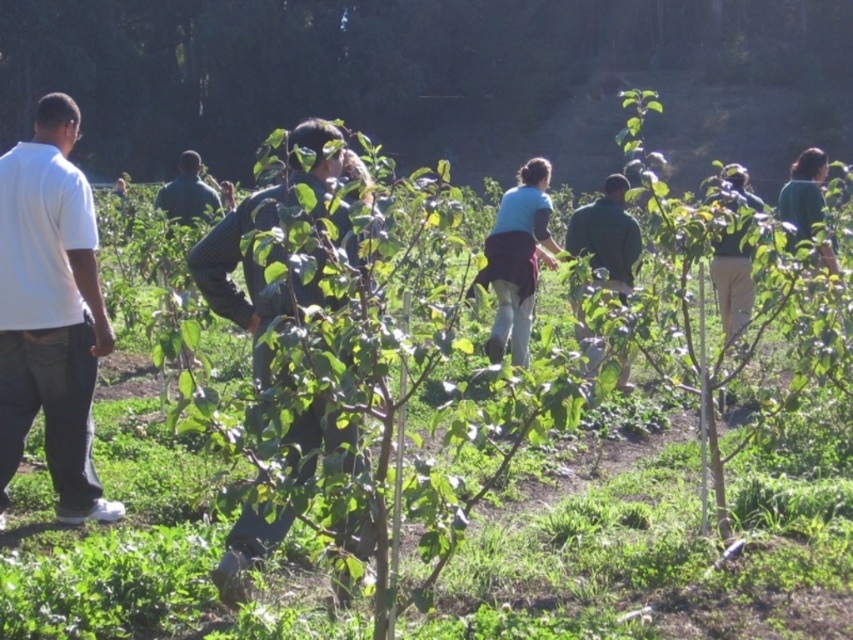
Can you confirm if green matte shirt at center is taller than dark green shirt at center?

In fact, green matte shirt at center may be shorter than dark green shirt at center.

Between point (622, 252) and point (193, 196), which one is positioned in front?

Point (622, 252) is more forward.

Between point (625, 179) and point (189, 225), which one is positioned behind?

Positioned behind is point (189, 225).

This screenshot has width=853, height=640. What are the coordinates of `green matte shirt at center` in the screenshot? It's located at (607, 236).

Is point (45, 426) closer to viewer compared to point (230, 545)?

No, it is not.

Find the location of a particular element. white cotton shirt at left is located at coordinates pos(50,310).

Does white cotton shirt at left appear over dark green shirt at center?

No.

Does point (19, 179) lie behind point (194, 173)?

No, it is in front of (194, 173).

Where is `white cotton shirt at left`? The width and height of the screenshot is (853, 640). white cotton shirt at left is located at coordinates (50, 310).